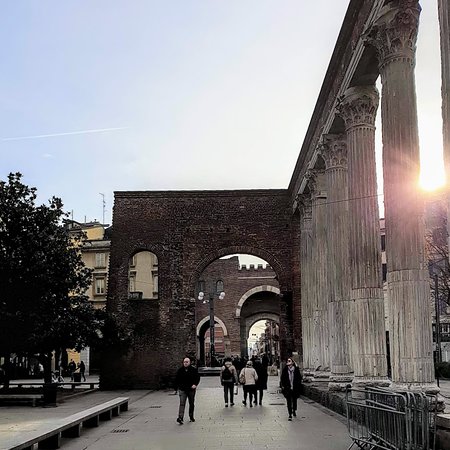
The image size is (450, 450). I want to click on benches, so click(85, 415), click(20, 398).